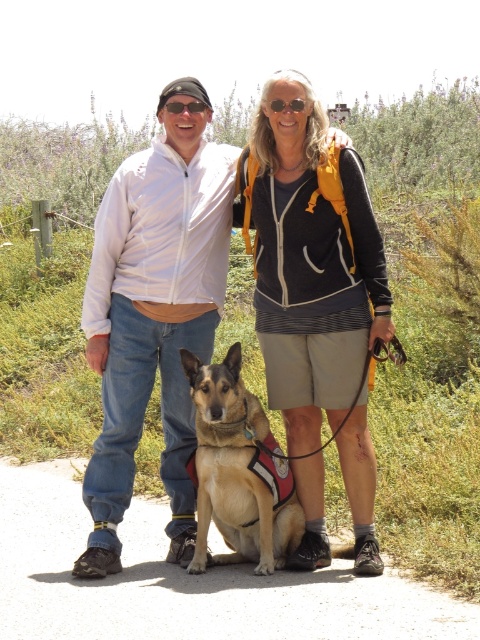
Based on the photo, you are a photographer trying to capture a photo of the brown fur dog at center. You need to position yourself so that the matte black jacket at center does not block the dog. Which side of the dog should you stand to avoid the jacket obstructing the view?

The matte black jacket at center is positioned on the left side of brown fur dog at center, so you should stand to the right side of the brown fur dog at center to avoid the jacket blocking the view.

You are a photographer trying to capture a photo of the brown fur dog at center. The matte black jacket at center is blocking your view. Can you move the jacket to the side to get a clear shot of the dog?

The matte black jacket at center is above the brown fur dog at center, so moving the jacket down would allow you to see the dog below it.